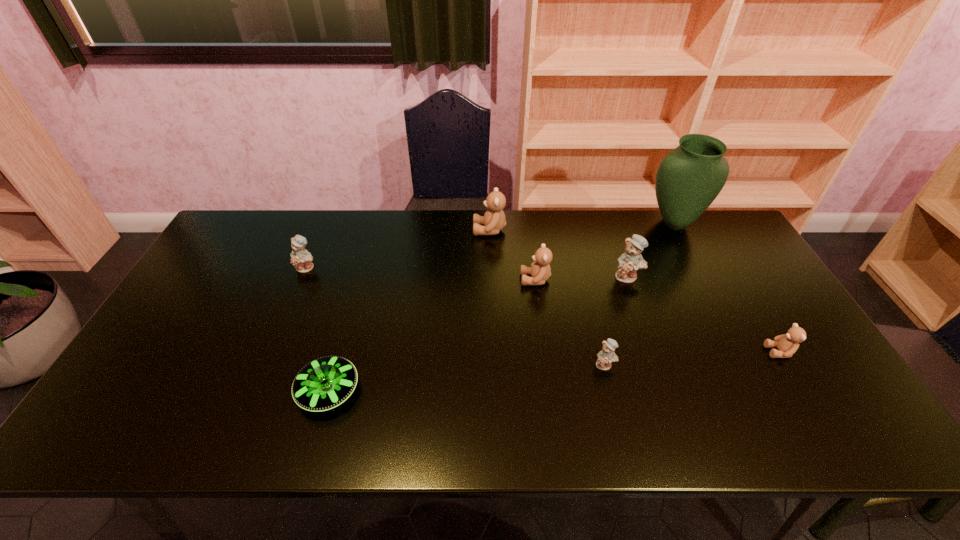
You are a GUI agent. You are given a task and a screenshot of the screen. Output one action in this format:
    pyautogui.click(x=<x>, y=<y>)
    Task: Click on the green vase
    
    Given the screenshot: What is the action you would take?
    pyautogui.click(x=689, y=178)

Locate an element on the screen. vase is located at coordinates (689, 178).

Identify the location of the farthest brown teddy bear. (494, 220).

Where is `the farthest teddy bear`? The image size is (960, 540). the farthest teddy bear is located at coordinates (494, 220).

Find the location of a particular element. Image resolution: width=960 pixels, height=540 pixels. the fifth teddy bear from left to right is located at coordinates (629, 262).

Identify the location of the biggest blue teddy bear. This screenshot has height=540, width=960. (629, 262).

Find the location of a particular element. The image size is (960, 540). the third teddy bear from left to right is located at coordinates (540, 270).

Image resolution: width=960 pixels, height=540 pixels. Find the location of `the second brown teddy bear from left to right`. the second brown teddy bear from left to right is located at coordinates (540, 270).

The image size is (960, 540). Identify the location of the leftmost object. (301, 259).

The image size is (960, 540). Find the location of `the leftmost blue teddy bear`. the leftmost blue teddy bear is located at coordinates (301, 259).